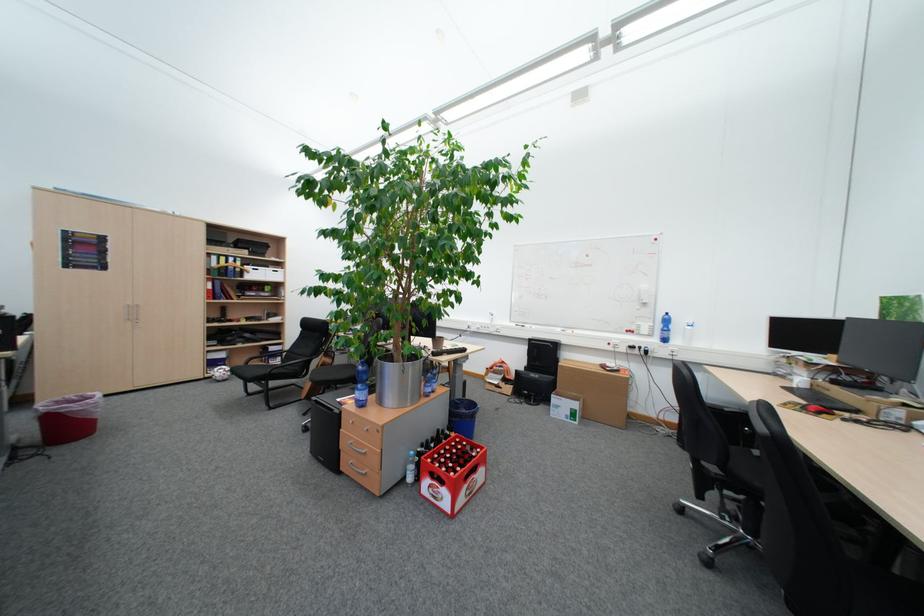
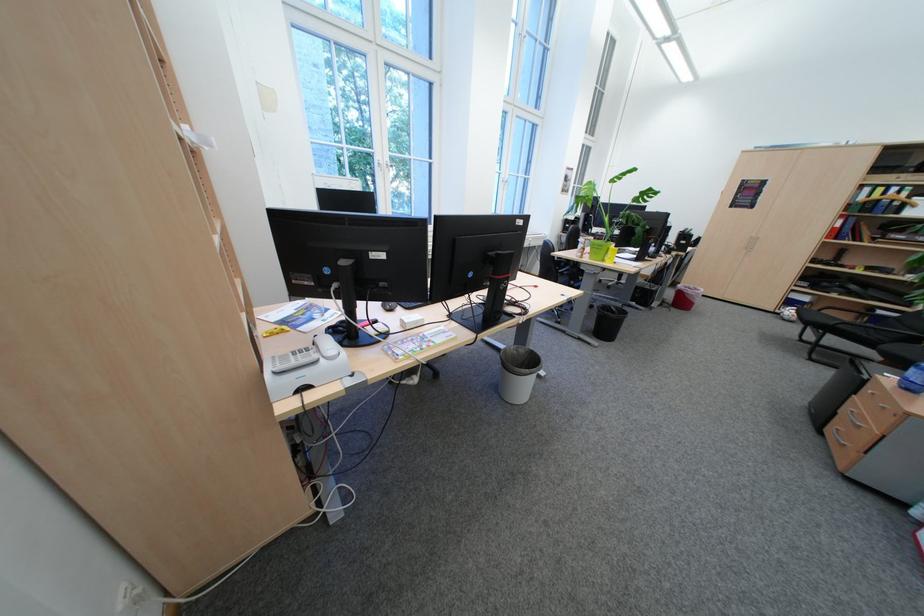
Locate, in the second image, the point that corresponds to [222,256] in the first image.

(873, 188)